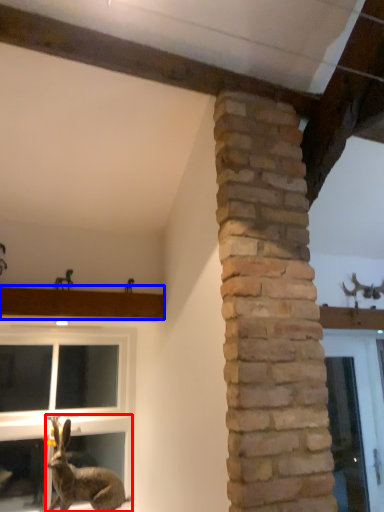
Question: Which point is further to the camera, rabbit (highlighted by a red box) or window sill (highlighted by a blue box)?

Choices:
 (A) rabbit
 (B) window sill

Answer: (B)